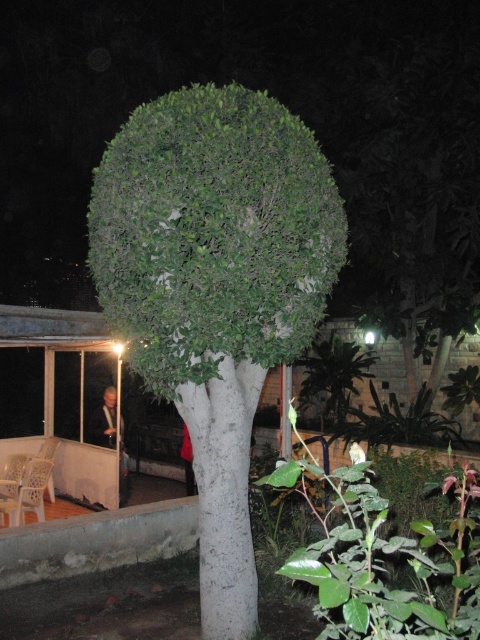
The width and height of the screenshot is (480, 640). In order to click on green leafy tree at center in this screenshot , I will do `click(216, 288)`.

Consider the image. Does green leafy tree at center have a greater width compared to white plastic chair at lower left?

Indeed, green leafy tree at center has a greater width compared to white plastic chair at lower left.

What do you see at coordinates (216, 288) in the screenshot?
I see `green leafy tree at center` at bounding box center [216, 288].

Find the location of a particular element. The height and width of the screenshot is (640, 480). green leafy tree at center is located at coordinates (216, 288).